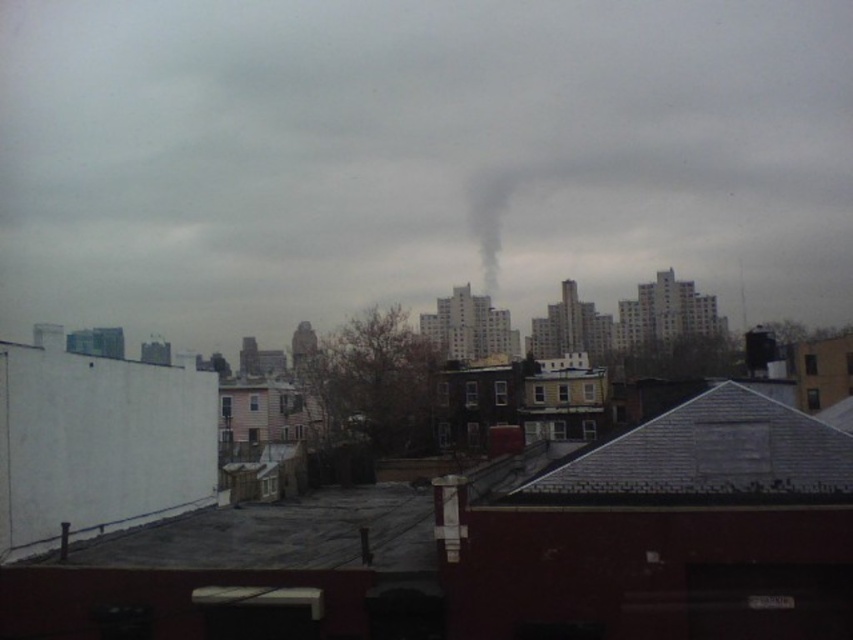
The image size is (853, 640). Describe the element at coordinates (415, 156) in the screenshot. I see `smoke at upper center` at that location.

Can you confirm if smoke at upper center is shorter than black smoke at center?

In fact, smoke at upper center may be taller than black smoke at center.

This screenshot has width=853, height=640. What do you see at coordinates (415, 156) in the screenshot?
I see `smoke at upper center` at bounding box center [415, 156].

The image size is (853, 640). Find the location of `smoke at upper center`. smoke at upper center is located at coordinates 415,156.